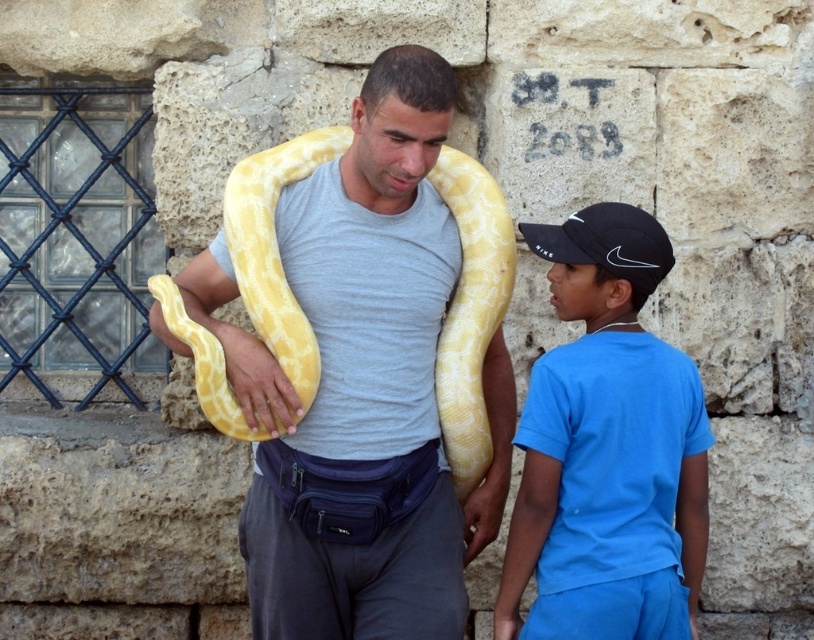
You are a photographer taking a photo of the scene. You want to ensure the yellow matte snake at center is in focus. Where should you aim your camera? Please provide the coordinates as a point in the format of point with two decimals like point (381, 164).

The yellow matte snake at center is located at point (381, 164), so you should aim your camera at point (381, 164) to ensure it is in focus.

You are a photographer standing in front of the two subjects. You want to take a photo that clearly shows both the blue cotton shirt at right and the yellow matte snake at center. Which subject should you focus on first to ensure both are in sharp focus?

You should focus on the blue cotton shirt at right first because it is closer to the viewer than the yellow matte snake at center, so ensuring the shirt is in focus will also keep the snake in focus due to depth of field.

You are a photographer trying to capture a candid shot of the two subjects. You notice two points of interest marked at coordinates point (357, 211) and point (392, 192). If you want to ensure both points are in focus without any obstruction, which point should you focus on first?

You should focus on point (392, 192) first because it is in front of point (357, 211). By focusing on the closer point, you can ensure that both points remain in focus as the depth of field will extend backward to include the point behind it.